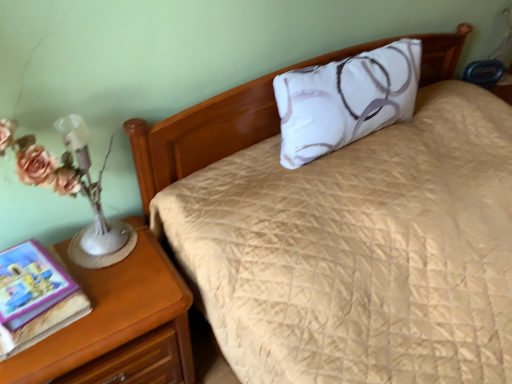
Image resolution: width=512 pixels, height=384 pixels. Describe the element at coordinates (118, 325) in the screenshot. I see `wooden nightstand at lower left` at that location.

Locate an element on the screen. This screenshot has width=512, height=384. hardcover book at left is located at coordinates (30, 283).

From a real-world perspective, who is located higher, hardcover book at left or white satin pillow at center?

From a 3D spatial view, white satin pillow at center is above.

Considering their positions, is hardcover book at left located in front of or behind white satin pillow at center?

Visually, hardcover book at left is located in front of white satin pillow at center.

Looking at this image, between hardcover book at left and white satin pillow at center, which one appears on the left side from the viewer's perspective?

Positioned to the left is hardcover book at left.

Would you say hardcover book at left is outside white satin pillow at center?

hardcover book at left is positioned outside white satin pillow at center.

Consider the image. How many degrees apart are the facing directions of white satin pillow at center and hardcover book at left?

5.79 degrees separate the facing orientations of white satin pillow at center and hardcover book at left.

From a real-world perspective, between white satin pillow at center and hardcover book at left, who is vertically lower?

From a 3D spatial view, hardcover book at left is below.

Looking at the image, does white satin pillow at center seem bigger or smaller compared to hardcover book at left?

white satin pillow at center is bigger than hardcover book at left.

From the image's perspective, who appears lower, white satin pillow at center or hardcover book at left?

From the image's view, hardcover book at left is below.

Considering the sizes of wooden nightstand at lower left and hardcover book at left in the image, is wooden nightstand at lower left wider or thinner than hardcover book at left?

Considering their sizes, wooden nightstand at lower left looks broader than hardcover book at left.

Is wooden nightstand at lower left aimed at hardcover book at left?

No.

Is point (166, 366) closer or farther from the camera than point (23, 278)?

Point (166, 366) appears to be farther away from the viewer than point (23, 278).

In terms of height, does wooden nightstand at lower left look taller or shorter compared to white satin pillow at center?

Considering their sizes, wooden nightstand at lower left has more height than white satin pillow at center.

From a real-world perspective, is wooden nightstand at lower left positioned above or below white satin pillow at center?

Clearly, from a real-world perspective, wooden nightstand at lower left is below white satin pillow at center.

Could you tell me if wooden nightstand at lower left is turned towards white satin pillow at center?

No.

Which object is closer to the camera, wooden nightstand at lower left or white satin pillow at center?

wooden nightstand at lower left.

Considering the sizes of objects hardcover book at left and wooden nightstand at lower left in the image provided, who is shorter, hardcover book at left or wooden nightstand at lower left?

With less height is hardcover book at left.

Considering the points (1, 303) and (170, 285), which point is behind, point (1, 303) or point (170, 285)?

Positioned behind is point (170, 285).

Would you say hardcover book at left is a long distance from wooden nightstand at lower left?

No.

Can you tell me how much hardcover book at left and wooden nightstand at lower left differ in facing direction?

6.96 degrees.

Is white satin pillow at center shorter than wooden nightstand at lower left?

Correct, white satin pillow at center is not as tall as wooden nightstand at lower left.

The height and width of the screenshot is (384, 512). Find the location of `pillow above the wooden nightstand at lower left (from a real-world perspective)`. pillow above the wooden nightstand at lower left (from a real-world perspective) is located at coordinates (345, 100).

From a real-world perspective, relative to wooden nightstand at lower left, is white satin pillow at center vertically above or below?

Clearly, from a real-world perspective, white satin pillow at center is above wooden nightstand at lower left.

Considering the relative sizes of white satin pillow at center and wooden nightstand at lower left in the image provided, is white satin pillow at center smaller than wooden nightstand at lower left?

Yes.

This screenshot has width=512, height=384. I want to click on pillow on the right side of hardcover book at left, so click(345, 100).

Find the location of a particular element. This screenshot has width=512, height=384. pillow above the hardcover book at left (from the image's perspective) is located at coordinates (345, 100).

Based on their spatial positions, is wooden nightstand at lower left or hardcover book at left closer to white satin pillow at center?

Among the two, wooden nightstand at lower left is located nearer to white satin pillow at center.

Looking at the image, which one is located further to hardcover book at left, white satin pillow at center or wooden nightstand at lower left?

white satin pillow at center is positioned further to the anchor hardcover book at left.

Which object lies nearer to the anchor point wooden nightstand at lower left, hardcover book at left or white satin pillow at center?

Based on the image, hardcover book at left appears to be nearer to wooden nightstand at lower left.

Based on their spatial positions, is white satin pillow at center or hardcover book at left further from wooden nightstand at lower left?

white satin pillow at center is positioned further to the anchor wooden nightstand at lower left.

Consider the image. Looking at the image, which one is located closer to white satin pillow at center, hardcover book at left or wooden nightstand at lower left?

The object closer to white satin pillow at center is wooden nightstand at lower left.

Considering their positions, is wooden nightstand at lower left positioned closer to hardcover book at left than white satin pillow at center?

Among the two, wooden nightstand at lower left is located nearer to hardcover book at left.

The image size is (512, 384). I want to click on nightstand situated between hardcover book at left and white satin pillow at center from left to right, so click(118, 325).